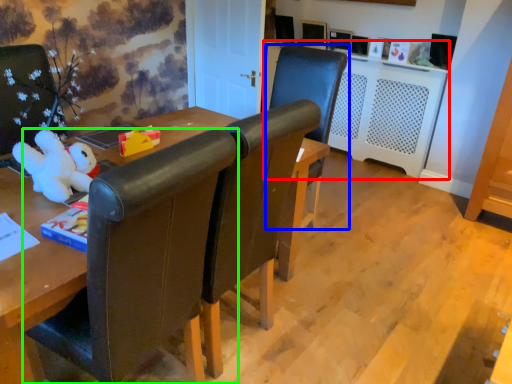
Question: Based on their relative distances, which object is farther from computer desk (highlighted by a red box)? Choose from chair (highlighted by a blue box) and chair (highlighted by a green box).

Choices:
 (A) chair
 (B) chair

Answer: (B)